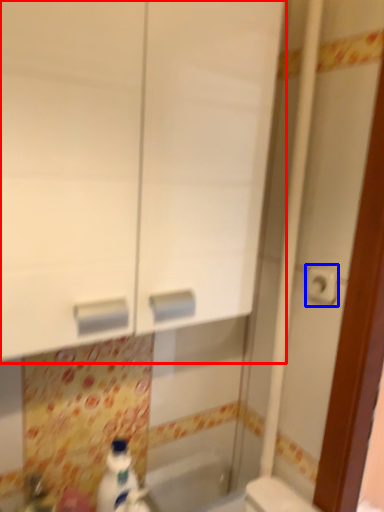
Question: Which object is further to the camera taking this photo, medicine cabinet (highlighted by a red box) or toilet paper (highlighted by a blue box)?

Choices:
 (A) medicine cabinet
 (B) toilet paper

Answer: (B)